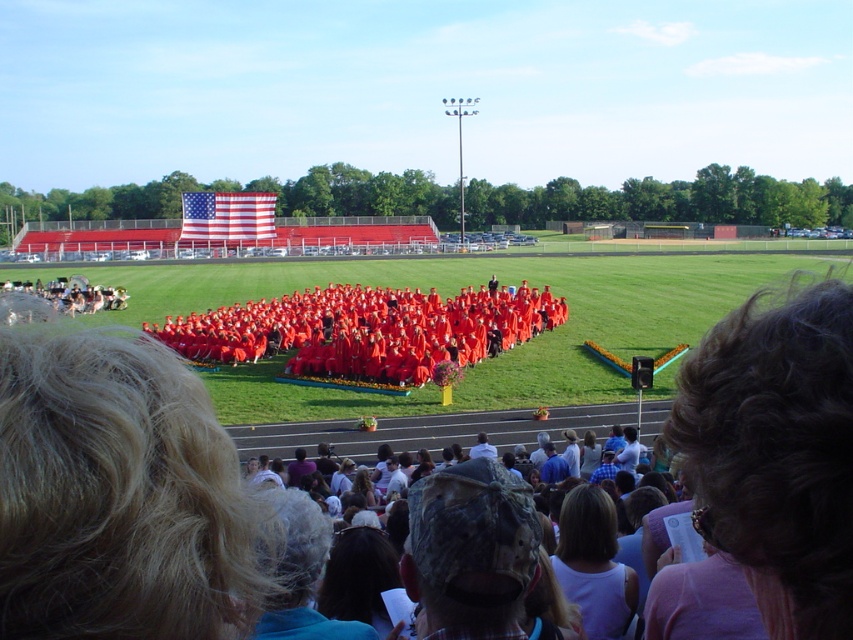
Question: Which object is positioned farthest from the blonde hair at lower left?

Choices:
 (A) light brown hair at lower center
 (B) american flag at upper left
 (C) dark brown hair at lower right

Answer: (B)

Question: Is dark brown hair at lower right below light brown hair at lower center?

Choices:
 (A) no
 (B) yes

Answer: (A)

Question: Is light brown hair at lower center behind american flag at upper left?

Choices:
 (A) yes
 (B) no

Answer: (B)

Question: Does dark brown hair at lower right have a larger size compared to american flag at upper left?

Choices:
 (A) no
 (B) yes

Answer: (A)

Question: Among these points, which one is farthest from the camera?

Choices:
 (A) (599, 618)
 (B) (167, 444)
 (C) (817, 429)

Answer: (A)

Question: Which object appears farthest from the camera in this image?

Choices:
 (A) dark brown hair at lower right
 (B) american flag at upper left

Answer: (B)